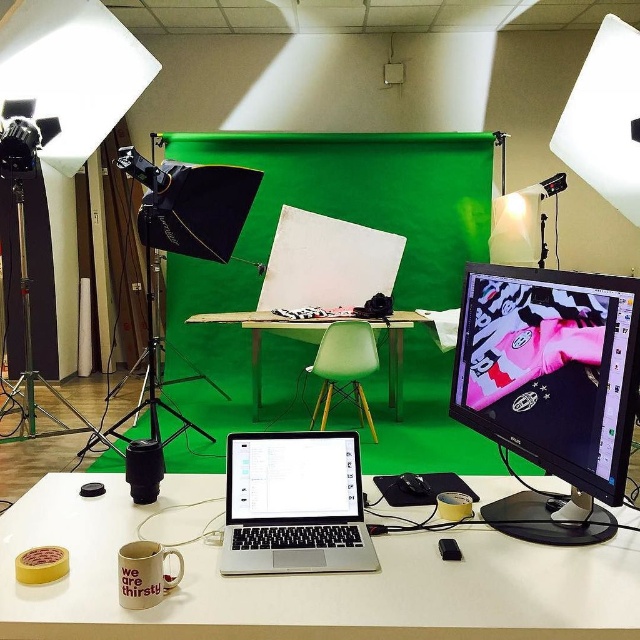
You are a photographer setting up a shoot in the studio. You need to place a large camera on the white matte table at center. Where exactly should you place it?

The white matte table at center is located at point (304, 579), so you should place the large camera there.

You are setting up a video call and need to position your camera so that both the silver metallic laptop at center and the green plastic chair at center are visible in the frame. Based on their positions, which object should be placed closer to the camera to ensure both are in view?

The silver metallic laptop at center is to the right of the green plastic chair at center, so to ensure both are visible, the camera should be positioned so that the green plastic chair at center is closer to the camera. This way, the silver metallic laptop at center, being further to the right, will still be within the frame.